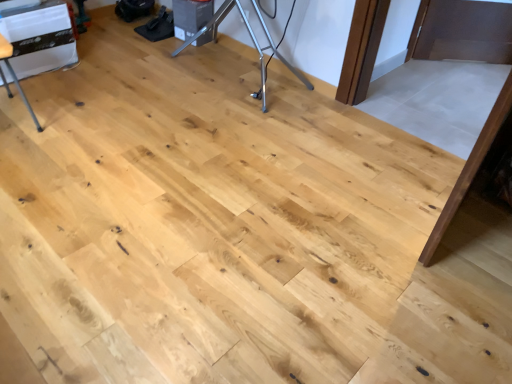
At what (x,y) coordinates should I click in order to perform the action: click on vacant area that lies between matte white appliance at left and silver metallic tripod at center. Please return your answer as a coordinate pair (x, y). Looking at the image, I should click on (145, 79).